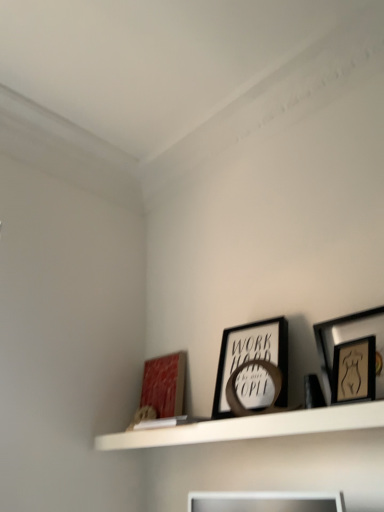
Question: Is white matte shelf at upper center shorter than wooden framed artwork at upper right, acting as the 3th picture frame starting from the back?

Choices:
 (A) no
 (B) yes

Answer: (B)

Question: Is white matte shelf at upper center taller than wooden framed artwork at upper right, marked as the first picture frame in a right-to-left arrangement?

Choices:
 (A) no
 (B) yes

Answer: (A)

Question: From the image's perspective, is white matte shelf at upper center located above wooden framed artwork at upper right, which ranks as the 3th picture frame in left-to-right order?

Choices:
 (A) no
 (B) yes

Answer: (A)

Question: Does white matte shelf at upper center appear on the left side of wooden framed artwork at upper right, marked as the first picture frame in a right-to-left arrangement?

Choices:
 (A) no
 (B) yes

Answer: (B)

Question: Is the depth of white matte shelf at upper center greater than that of wooden framed artwork at upper right, which ranks as the 3th picture frame in left-to-right order?

Choices:
 (A) no
 (B) yes

Answer: (A)

Question: Is point (269, 385) closer or farther from the camera than point (319, 430)?

Choices:
 (A) farther
 (B) closer

Answer: (A)

Question: From the image's perspective, is black matte picture frame at center, which is the second picture frame from front to back, above or below white matte shelf at upper center?

Choices:
 (A) above
 (B) below

Answer: (A)

Question: In terms of height, does black matte picture frame at center, which is the second picture frame from front to back, look taller or shorter compared to white matte shelf at upper center?

Choices:
 (A) tall
 (B) short

Answer: (A)

Question: Considering the positions of black matte picture frame at center, which is the second picture frame from front to back, and white matte shelf at upper center in the image, is black matte picture frame at center, which is the second picture frame from front to back, wider or thinner than white matte shelf at upper center?

Choices:
 (A) wide
 (B) thin

Answer: (B)

Question: Is wooden framed artwork at upper right, which ranks as the 3th picture frame in left-to-right order, to the left or to the right of black matte picture frame at center, marked as the second picture frame in a left-to-right arrangement, in the image?

Choices:
 (A) left
 (B) right

Answer: (B)

Question: Considering the positions of wooden framed artwork at upper right, which ranks as the 3th picture frame in left-to-right order, and black matte picture frame at center, which is the second picture frame from front to back, in the image, is wooden framed artwork at upper right, which ranks as the 3th picture frame in left-to-right order, taller or shorter than black matte picture frame at center, which is the second picture frame from front to back,?

Choices:
 (A) tall
 (B) short

Answer: (B)

Question: Is wooden framed artwork at upper right, which ranks as the first picture frame in front-to-back order, bigger or smaller than black matte picture frame at center, which is the 2th picture frame in back-to-front order?

Choices:
 (A) small
 (B) big

Answer: (A)

Question: Considering the positions of wooden framed artwork at upper right, marked as the first picture frame in a right-to-left arrangement, and black matte picture frame at center, marked as the second picture frame in a left-to-right arrangement, in the image, is wooden framed artwork at upper right, marked as the first picture frame in a right-to-left arrangement, wider or thinner than black matte picture frame at center, marked as the second picture frame in a left-to-right arrangement,?

Choices:
 (A) wide
 (B) thin

Answer: (B)

Question: Does point (271, 340) appear closer or farther from the camera than point (375, 354)?

Choices:
 (A) closer
 (B) farther

Answer: (B)

Question: From a real-world perspective, is black matte picture frame at center, the second picture frame when ordered from right to left, positioned above or below wooden framed artwork at upper right, marked as the first picture frame in a right-to-left arrangement?

Choices:
 (A) below
 (B) above

Answer: (B)